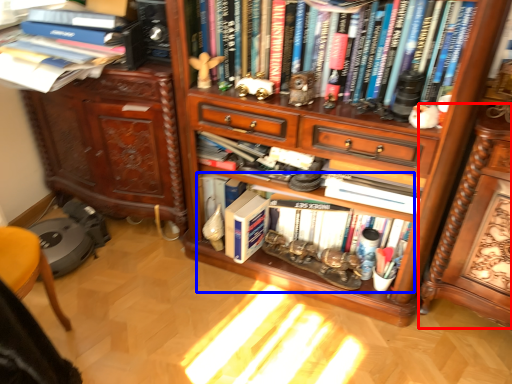
Question: Among these objects, which one is farthest to the camera, computer desk (highlighted by a red box) or book (highlighted by a blue box)?

Choices:
 (A) computer desk
 (B) book

Answer: (B)